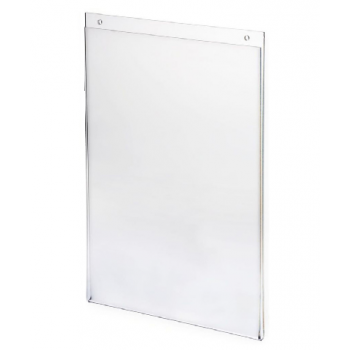
Locate an element on the screen. Image resolution: width=350 pixels, height=350 pixels. glass pane is located at coordinates click(x=190, y=136).